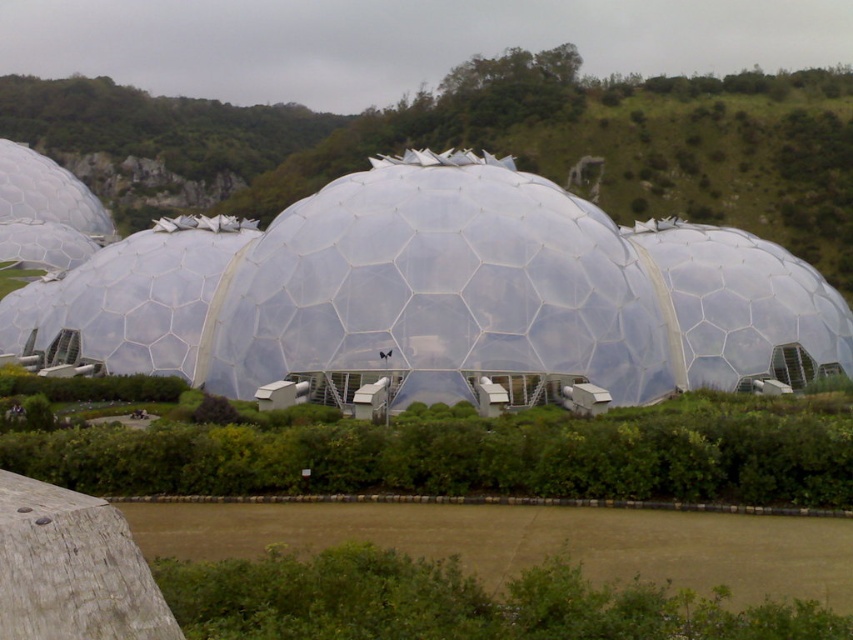
Question: Is transparent glass dome at center above green grassy hillside at upper center?

Choices:
 (A) no
 (B) yes

Answer: (A)

Question: In this image, where is transparent glass dome at center located relative to green grassy hillside at upper center?

Choices:
 (A) left
 (B) right

Answer: (B)

Question: Is transparent glass dome at center behind green grassy hillside at upper center?

Choices:
 (A) yes
 (B) no

Answer: (B)